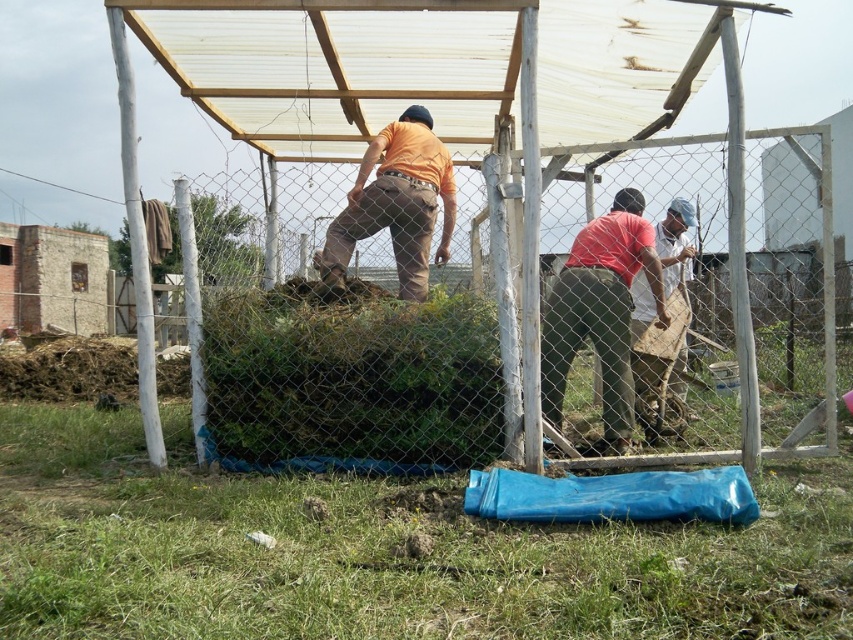
Is transparent plastic canopy at upper center positioned before green leafy hedge at center?

That is True.

Between point (184, 58) and point (234, 394), which one is positioned behind?

Positioned behind is point (184, 58).

I want to click on transparent plastic canopy at upper center, so click(x=428, y=65).

Does green leafy hedge at center lie behind orange matte shirt at center?

No.

What do you see at coordinates (351, 380) in the screenshot? This screenshot has width=853, height=640. I see `green leafy hedge at center` at bounding box center [351, 380].

Find the location of `green leafy hedge at center`. green leafy hedge at center is located at coordinates (351, 380).

Between transparent plastic canopy at upper center and orange matte shirt at center, which one is positioned lower?

orange matte shirt at center is below.

Can you confirm if transparent plastic canopy at upper center is wider than orange matte shirt at center?

Yes.

The width and height of the screenshot is (853, 640). In order to click on transparent plastic canopy at upper center in this screenshot , I will do `click(428, 65)`.